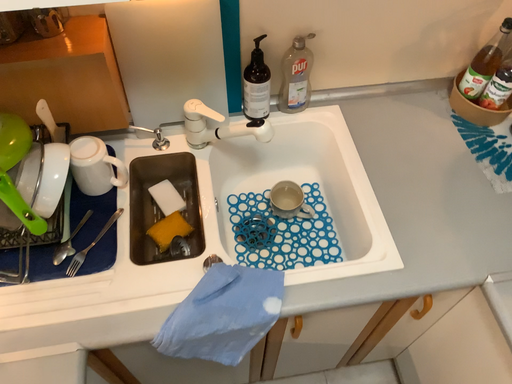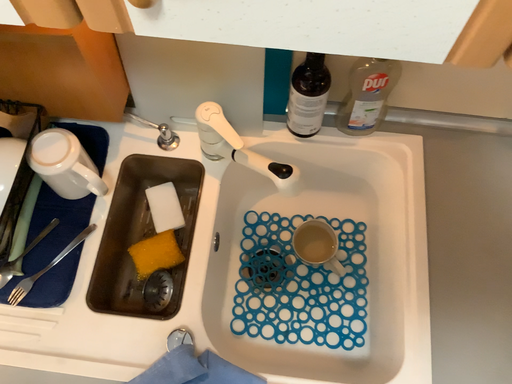
Question: How did the camera likely rotate when shooting the video?

Choices:
 (A) rotated right
 (B) rotated left

Answer: (B)